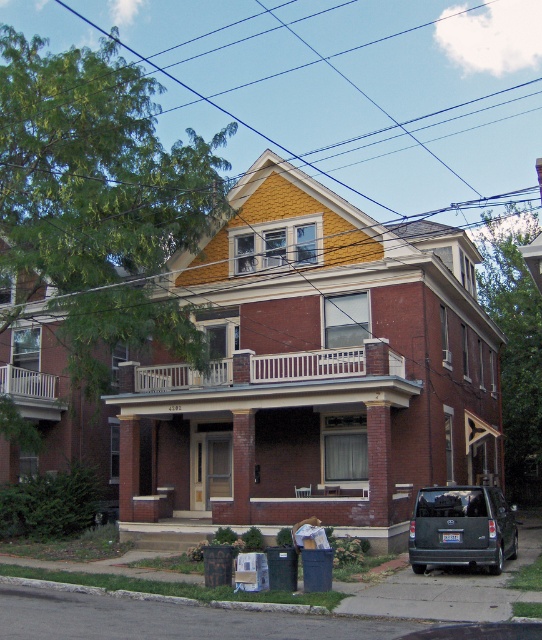
Can you confirm if dark gray matte suv at lower right is thinner than white wooden balcony at lower left?

No, dark gray matte suv at lower right is not thinner than white wooden balcony at lower left.

Is dark gray matte suv at lower right bigger than white wooden balcony at lower left?

Yes.

Is point (506, 522) positioned behind point (20, 412)?

No.

I want to click on dark gray matte suv at lower right, so click(461, 528).